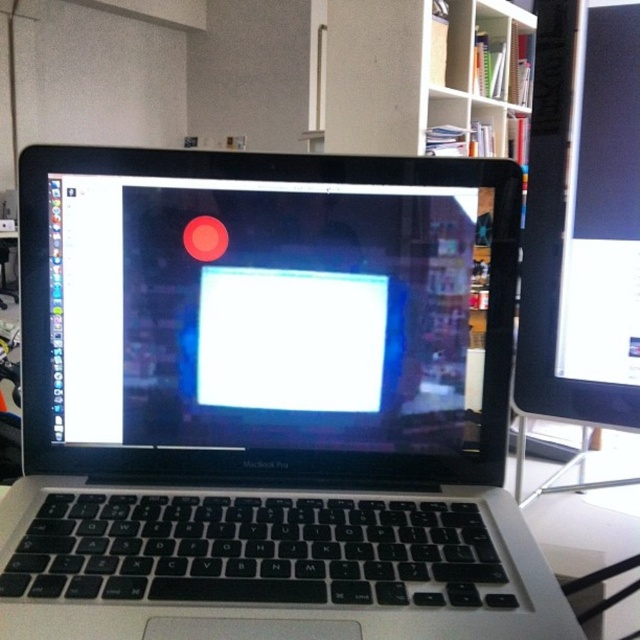
Question: Which point is farther to the camera?

Choices:
 (A) silver/black plastic laptop at center
 (B) matte black monitor at right

Answer: (B)

Question: Which point is closer to the camera taking this photo?

Choices:
 (A) (625, 145)
 (B) (356, 609)

Answer: (B)

Question: Does silver/black plastic laptop at center lie behind matte black monitor at right?

Choices:
 (A) no
 (B) yes

Answer: (A)

Question: Does silver/black plastic laptop at center appear on the right side of matte black monitor at right?

Choices:
 (A) yes
 (B) no

Answer: (B)

Question: Can you confirm if silver/black plastic laptop at center is positioned to the right of matte black monitor at right?

Choices:
 (A) no
 (B) yes

Answer: (A)